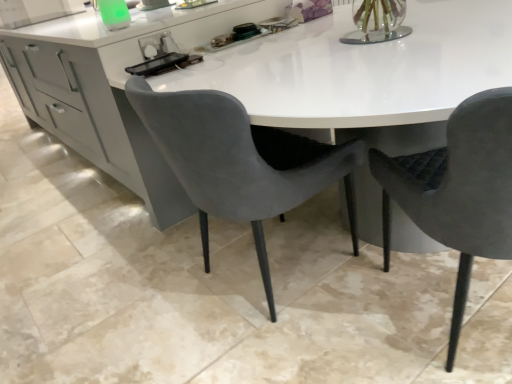
What do you see at coordinates (462, 192) in the screenshot? Image resolution: width=512 pixels, height=384 pixels. I see `velvet grey chair at right, the first chair from the right` at bounding box center [462, 192].

The height and width of the screenshot is (384, 512). What are the coordinates of `velvet grey chair at right, marked as the second chair in a left-to-right arrangement` in the screenshot? It's located at (462, 192).

Image resolution: width=512 pixels, height=384 pixels. In order to click on velvet grey chair at center, the first chair when ordered from left to right in this screenshot , I will do `click(234, 164)`.

Describe the element at coordinates (234, 164) in the screenshot. I see `velvet grey chair at center, the first chair when ordered from left to right` at that location.

Find the location of a particular element. The image size is (512, 384). velvet grey chair at right, marked as the second chair in a left-to-right arrangement is located at coordinates (462, 192).

Looking at this image, considering the positions of objects velvet grey chair at center, the first chair when ordered from left to right, and velvet grey chair at right, the first chair from the right, in the image provided, who is more to the left, velvet grey chair at center, the first chair when ordered from left to right, or velvet grey chair at right, the first chair from the right,?

From the viewer's perspective, velvet grey chair at center, the first chair when ordered from left to right, appears more on the left side.

Is velvet grey chair at center, arranged as the 2th chair when viewed from the right, positioned behind velvet grey chair at right, marked as the second chair in a left-to-right arrangement?

Yes, it is behind velvet grey chair at right, marked as the second chair in a left-to-right arrangement.

Is point (225, 105) closer or farther from the camera than point (471, 225)?

Point (225, 105) appears to be farther away from the viewer than point (471, 225).

In the scene shown: From the image's perspective, is velvet grey chair at center, the first chair when ordered from left to right, over velvet grey chair at right, marked as the second chair in a left-to-right arrangement?

Indeed, from the image's perspective, velvet grey chair at center, the first chair when ordered from left to right, is shown above velvet grey chair at right, marked as the second chair in a left-to-right arrangement.

From a real-world perspective, does velvet grey chair at center, arranged as the 2th chair when viewed from the right, sit lower than velvet grey chair at right, the first chair from the right?

No, from a real-world perspective, velvet grey chair at center, arranged as the 2th chair when viewed from the right, is not beneath velvet grey chair at right, the first chair from the right.

Between velvet grey chair at center, arranged as the 2th chair when viewed from the right, and velvet grey chair at right, the first chair from the right, which one has larger width?

With larger width is velvet grey chair at right, the first chair from the right.

Does velvet grey chair at center, arranged as the 2th chair when viewed from the right, have a greater height compared to velvet grey chair at right, marked as the second chair in a left-to-right arrangement?

Incorrect, the height of velvet grey chair at center, arranged as the 2th chair when viewed from the right, is not larger of that of velvet grey chair at right, marked as the second chair in a left-to-right arrangement.

Is velvet grey chair at center, the first chair when ordered from left to right, bigger than velvet grey chair at right, the first chair from the right?

Yes, velvet grey chair at center, the first chair when ordered from left to right, is bigger than velvet grey chair at right, the first chair from the right.

Do you think velvet grey chair at center, arranged as the 2th chair when viewed from the right, is within velvet grey chair at right, marked as the second chair in a left-to-right arrangement, or outside of it?

velvet grey chair at center, arranged as the 2th chair when viewed from the right, lies outside velvet grey chair at right, marked as the second chair in a left-to-right arrangement.

Is there a large distance between velvet grey chair at center, arranged as the 2th chair when viewed from the right, and velvet grey chair at right, marked as the second chair in a left-to-right arrangement?

velvet grey chair at center, arranged as the 2th chair when viewed from the right, is near velvet grey chair at right, marked as the second chair in a left-to-right arrangement, not far away.

Could you tell me if velvet grey chair at center, the first chair when ordered from left to right, is facing velvet grey chair at right, marked as the second chair in a left-to-right arrangement?

No, velvet grey chair at center, the first chair when ordered from left to right, does not turn towards velvet grey chair at right, marked as the second chair in a left-to-right arrangement.

Could you measure the distance between velvet grey chair at center, the first chair when ordered from left to right, and velvet grey chair at right, the first chair from the right?

A distance of 16.18 inches exists between velvet grey chair at center, the first chair when ordered from left to right, and velvet grey chair at right, the first chair from the right.

At what (x,y) coordinates should I click in order to perform the action: click on chair in front of the velvet grey chair at center, the first chair when ordered from left to right. Please return your answer as a coordinate pair (x, y). Looking at the image, I should click on (462, 192).

Which is more to the right, velvet grey chair at right, the first chair from the right, or velvet grey chair at center, arranged as the 2th chair when viewed from the right?

From the viewer's perspective, velvet grey chair at right, the first chair from the right, appears more on the right side.

Considering the positions of objects velvet grey chair at right, the first chair from the right, and velvet grey chair at center, arranged as the 2th chair when viewed from the right, in the image provided, who is in front, velvet grey chair at right, the first chair from the right, or velvet grey chair at center, arranged as the 2th chair when viewed from the right,?

velvet grey chair at right, the first chair from the right.

Is point (477, 133) positioned after point (348, 152)?

No.

From the image's perspective, relative to velvet grey chair at center, arranged as the 2th chair when viewed from the right, is velvet grey chair at right, marked as the second chair in a left-to-right arrangement, above or below?

From the image's perspective, velvet grey chair at right, marked as the second chair in a left-to-right arrangement, appears below velvet grey chair at center, arranged as the 2th chair when viewed from the right.

From a real-world perspective, is velvet grey chair at right, the first chair from the right, on velvet grey chair at center, arranged as the 2th chair when viewed from the right?

No, from a real-world perspective, velvet grey chair at right, the first chair from the right, is not above velvet grey chair at center, arranged as the 2th chair when viewed from the right.

Which of these two, velvet grey chair at right, the first chair from the right, or velvet grey chair at center, arranged as the 2th chair when viewed from the right, is thinner?

velvet grey chair at center, arranged as the 2th chair when viewed from the right.

Considering the relative sizes of velvet grey chair at right, marked as the second chair in a left-to-right arrangement, and velvet grey chair at center, arranged as the 2th chair when viewed from the right, in the image provided, is velvet grey chair at right, marked as the second chair in a left-to-right arrangement, taller than velvet grey chair at center, arranged as the 2th chair when viewed from the right,?

Yes.

Between velvet grey chair at right, marked as the second chair in a left-to-right arrangement, and velvet grey chair at center, the first chair when ordered from left to right, which one has smaller size?

velvet grey chair at right, marked as the second chair in a left-to-right arrangement, is smaller.

Is velvet grey chair at right, the first chair from the right, inside the boundaries of velvet grey chair at center, arranged as the 2th chair when viewed from the right, or outside?

The correct answer is: outside.

Are velvet grey chair at right, the first chair from the right, and velvet grey chair at center, the first chair when ordered from left to right, located far from each other?

They are positioned close to each other.

Does velvet grey chair at right, the first chair from the right, turn towards velvet grey chair at center, the first chair when ordered from left to right?

No, velvet grey chair at right, the first chair from the right, is not turned towards velvet grey chair at center, the first chair when ordered from left to right.

How distant is velvet grey chair at right, the first chair from the right, from velvet grey chair at center, the first chair when ordered from left to right?

velvet grey chair at right, the first chair from the right, is 16.18 inches from velvet grey chair at center, the first chair when ordered from left to right.

I want to click on chair above the velvet grey chair at right, marked as the second chair in a left-to-right arrangement (from a real-world perspective), so click(234, 164).

Find the location of a particular element. The image size is (512, 384). chair to the left of velvet grey chair at right, the first chair from the right is located at coordinates (234, 164).

Locate an element on the screen. This screenshot has width=512, height=384. chair located below the velvet grey chair at center, arranged as the 2th chair when viewed from the right (from the image's perspective) is located at coordinates (462, 192).